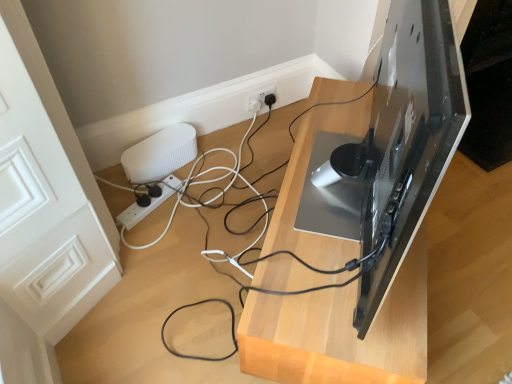
The image size is (512, 384). What are the coordinates of `vacant area that lies between white plastic power strip at lower center and white ribbed speaker at lower left` in the screenshot? It's located at (138, 198).